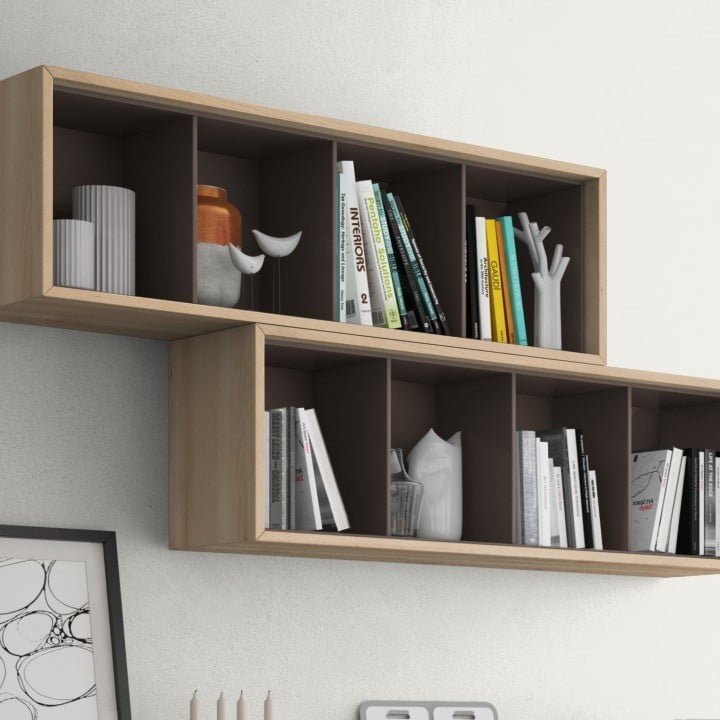
Locate an element on the screen. candles is located at coordinates (189, 710), (222, 701), (242, 701), (264, 703).